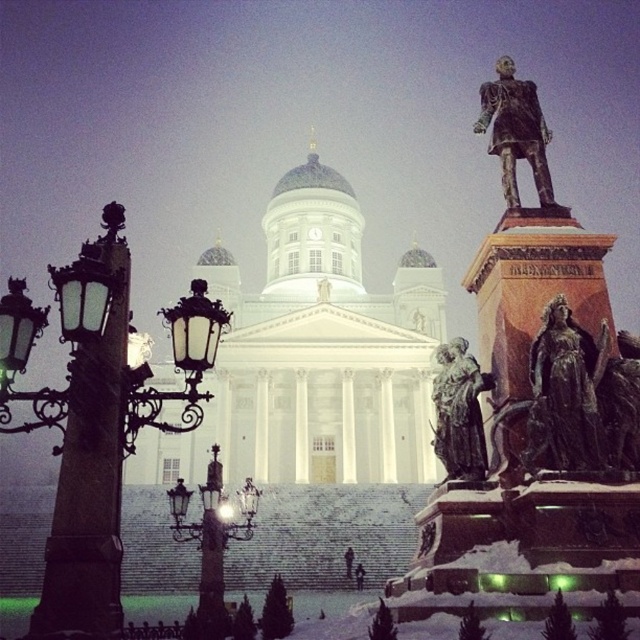
Question: Which point is closer to the camera taking this photo?

Choices:
 (A) (211, 468)
 (B) (93, 506)
 (C) (492, 150)
 (D) (444, 468)

Answer: (B)

Question: Considering the real-world distances, which object is closest to the bronze statue at upper right?

Choices:
 (A) matte black lamp post at left
 (B) polished brass streetlight at left
 (C) bronze statue at center-right
 (D) bronze statue at right

Answer: (D)

Question: Is bronze statue at right to the right of polished brass streetlight at lower center from the viewer's perspective?

Choices:
 (A) yes
 (B) no

Answer: (A)

Question: Which object is farther from the camera taking this photo?

Choices:
 (A) bronze statue at center-right
 (B) matte black lamp post at left
 (C) polished brass streetlight at left

Answer: (A)

Question: Can you confirm if bronze statue at right is bigger than polished brass streetlight at left?

Choices:
 (A) yes
 (B) no

Answer: (B)

Question: Can you confirm if polished brass streetlight at left is wider than matte black lamp post at left?

Choices:
 (A) yes
 (B) no

Answer: (A)